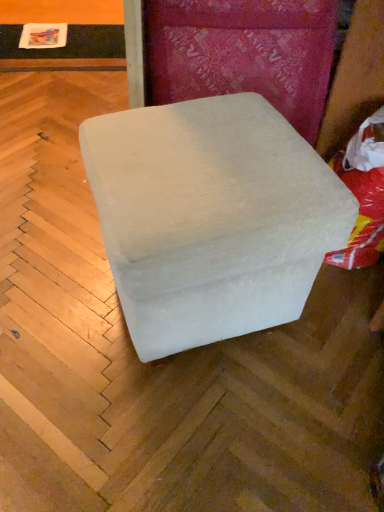
What is the approximate width of white fabric bean bag at right?

35.76 centimeters.

The width and height of the screenshot is (384, 512). I want to click on white fabric bean bag at right, so click(x=363, y=193).

The height and width of the screenshot is (512, 384). What do you see at coordinates (363, 193) in the screenshot? I see `white fabric bean bag at right` at bounding box center [363, 193].

Image resolution: width=384 pixels, height=512 pixels. Find the location of `white fabric ottoman at center`. white fabric ottoman at center is located at coordinates (211, 218).

This screenshot has width=384, height=512. Describe the element at coordinates (211, 218) in the screenshot. I see `white fabric ottoman at center` at that location.

The height and width of the screenshot is (512, 384). In order to click on white fabric bean bag at right in this screenshot , I will do `click(363, 193)`.

Considering the positions of objects white fabric ottoman at center and white fabric bean bag at right in the image provided, who is more to the right, white fabric ottoman at center or white fabric bean bag at right?

From the viewer's perspective, white fabric bean bag at right appears more on the right side.

Which object is closer to the camera taking this photo, white fabric ottoman at center or white fabric bean bag at right?

white fabric ottoman at center is closer to the camera.

Does point (89, 147) come in front of point (378, 172)?

That is True.

From the image's perspective, is white fabric ottoman at center above or below white fabric bean bag at right?

From the image's perspective, white fabric ottoman at center appears below white fabric bean bag at right.

From a real-world perspective, which object rests below the other?

From a 3D spatial view, white fabric bean bag at right is below.

Can you confirm if white fabric ottoman at center is thinner than white fabric bean bag at right?

No, white fabric ottoman at center is not thinner than white fabric bean bag at right.

Which of these two, white fabric ottoman at center or white fabric bean bag at right, stands taller?

With more height is white fabric ottoman at center.

Which of these two, white fabric ottoman at center or white fabric bean bag at right, is bigger?

Bigger between the two is white fabric ottoman at center.

Which is correct: white fabric ottoman at center is inside white fabric bean bag at right, or outside of it?

white fabric ottoman at center is outside white fabric bean bag at right.

In the scene shown: Is white fabric ottoman at center far away from white fabric bean bag at right?

No, white fabric ottoman at center is in close proximity to white fabric bean bag at right.

Is white fabric ottoman at center facing away from white fabric bean bag at right?

Yes, white fabric ottoman at center is positioned with its back facing white fabric bean bag at right.

How different are the orientations of white fabric ottoman at center and white fabric bean bag at right in degrees?

The angular difference between white fabric ottoman at center and white fabric bean bag at right is 8.17 degrees.

You are a GUI agent. You are given a task and a screenshot of the screen. Output one action in this format:
    pyautogui.click(x=<x>, y=<y>)
    Task: Click on the furniture on the left side of white fabric bean bag at right
    The height and width of the screenshot is (512, 384).
    Given the screenshot: What is the action you would take?
    pyautogui.click(x=211, y=218)

Which object is positioned more to the right, white fabric bean bag at right or white fabric ottoman at center?

From the viewer's perspective, white fabric bean bag at right appears more on the right side.

Considering their positions, is white fabric bean bag at right located in front of or behind white fabric ottoman at center?

Clearly, white fabric bean bag at right is behind white fabric ottoman at center.

Is point (379, 233) closer to camera compared to point (277, 225)?

That is False.

From the image's perspective, who appears lower, white fabric bean bag at right or white fabric ottoman at center?

white fabric ottoman at center, from the image's perspective.

From a real-world perspective, who is located lower, white fabric bean bag at right or white fabric ottoman at center?

From a 3D spatial view, white fabric bean bag at right is below.

Considering the sizes of white fabric bean bag at right and white fabric ottoman at center in the image, is white fabric bean bag at right wider or thinner than white fabric ottoman at center?

Clearly, white fabric bean bag at right has less width compared to white fabric ottoman at center.

Is white fabric bean bag at right taller than white fabric ottoman at center?

No.

Between white fabric bean bag at right and white fabric ottoman at center, which one has smaller size?

white fabric bean bag at right.

Is white fabric bean bag at right located outside white fabric ottoman at center?

Yes.

Consider the image. Would you consider white fabric bean bag at right to be distant from white fabric ottoman at center?

No, there isn't a large distance between white fabric bean bag at right and white fabric ottoman at center.

Is white fabric bean bag at right looking in the opposite direction of white fabric ottoman at center?

No, white fabric bean bag at right is not facing the opposite direction of white fabric ottoman at center.

From the picture: Can you tell me how much white fabric bean bag at right and white fabric ottoman at center differ in facing direction?

The angular difference between white fabric bean bag at right and white fabric ottoman at center is 8.17 degrees.

How distant is white fabric bean bag at right from white fabric ottoman at center?

white fabric bean bag at right and white fabric ottoman at center are 42.33 centimeters apart from each other.

Find the location of a particular element. bean bag chair below the white fabric ottoman at center (from a real-world perspective) is located at coordinates (363, 193).

You are a GUI agent. You are given a task and a screenshot of the screen. Output one action in this format:
    pyautogui.click(x=<x>, y=<y>)
    Task: Click on the furniture to the left of white fabric bean bag at right
    The height and width of the screenshot is (512, 384).
    Given the screenshot: What is the action you would take?
    pyautogui.click(x=211, y=218)

Locate an element on the screen. The width and height of the screenshot is (384, 512). bean bag chair on the right of white fabric ottoman at center is located at coordinates (363, 193).